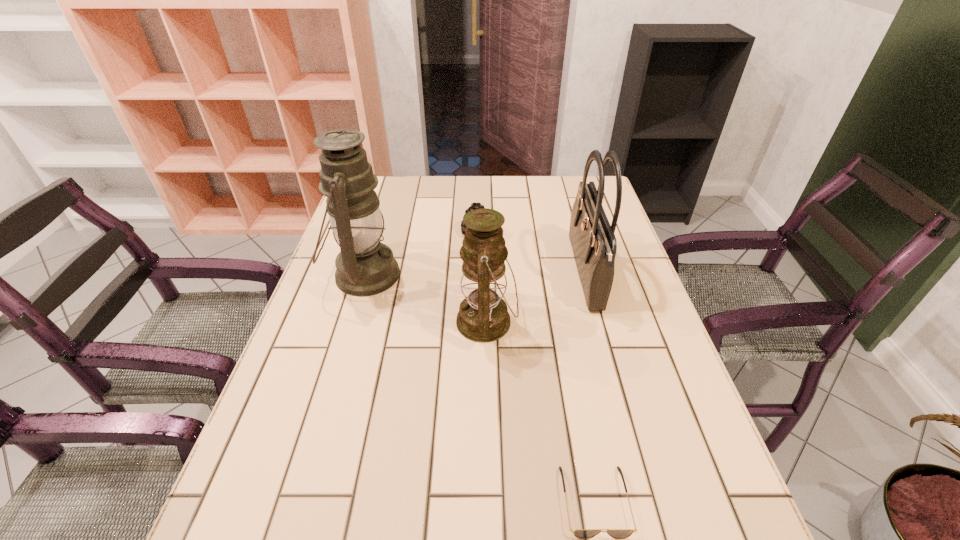
Find the location of a particular element. vacant area between the fourth tallest object and the rightmost object is located at coordinates (531, 253).

The width and height of the screenshot is (960, 540). Identify the location of free area in between the pinecone and the second object from right to left. (536, 367).

What are the coordinates of `free spot between the shorter oil lamp and the taller oil lamp` in the screenshot? It's located at (425, 299).

The height and width of the screenshot is (540, 960). Find the location of `free space that is in between the second shortest object and the nearest object`. free space that is in between the second shortest object and the nearest object is located at coordinates (536, 367).

The image size is (960, 540). What are the coordinates of `vacant space that is in between the handbag and the right oil lamp` in the screenshot? It's located at (536, 298).

Where is `blank region between the handbag and the shortest object`? The image size is (960, 540). blank region between the handbag and the shortest object is located at coordinates (589, 387).

The height and width of the screenshot is (540, 960). I want to click on the closest object to the taller oil lamp, so click(474, 205).

Identify the location of object that is the fourth closest one to the right oil lamp. (580, 533).

The width and height of the screenshot is (960, 540). Find the location of `free point that satisfies the following two spatial constraints: 1. at the narrow end of the second shortest object; 2. on the right side of the right oil lamp`. free point that satisfies the following two spatial constraints: 1. at the narrow end of the second shortest object; 2. on the right side of the right oil lamp is located at coordinates (476, 322).